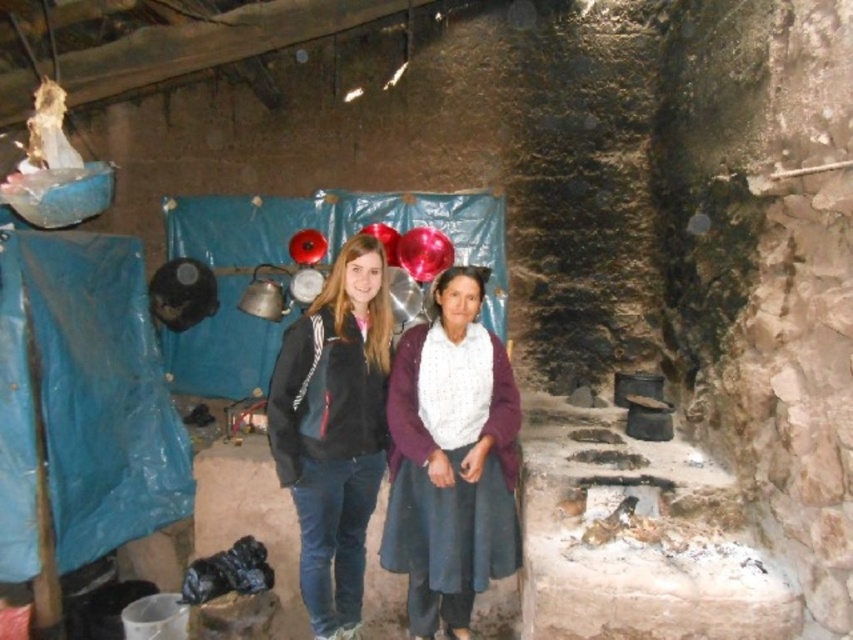
In the rustic kitchen scene, there are two people standing side by side. The person on the left is wearing a black jacket with white stripes on the sleeves and blue jeans. The person on the right is wearing a maroon cardigan over a white. Where exactly is the point at coordinate [451,460] located?

The point at coordinate [451,460] is located on the white knitted sweater at center.

You are standing in the rustic kitchen and need to reach both the white knitted sweater at center and the black fleece jacket at center. Which item is easier to grab without moving your current position?

The white knitted sweater at center is closer to the viewer than the black fleece jacket at center, so it is easier to grab without moving.